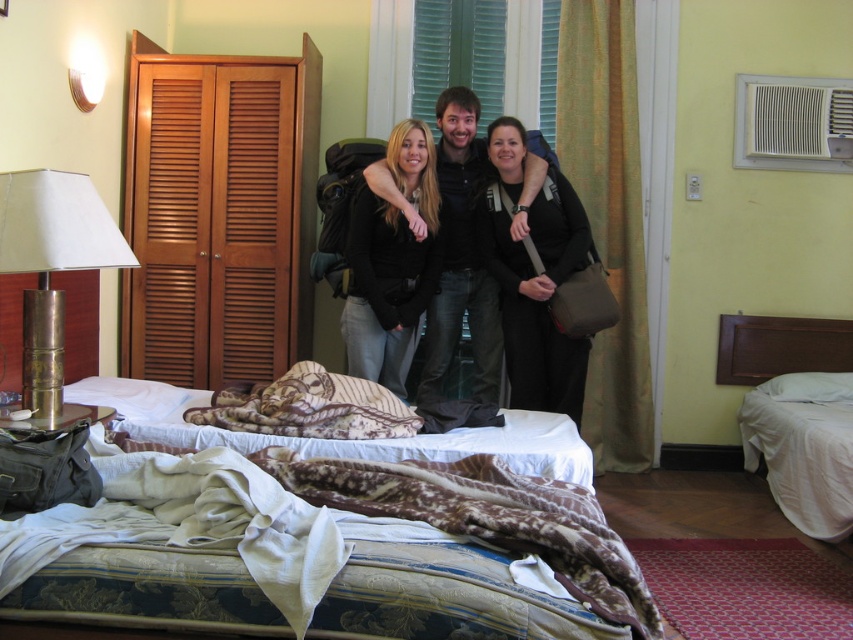
You are trying to decide whether to hang the black matte jacket at center on a coat hanger that is 1.2 meters tall. The brown textured blanket at center is nearby. Based on their heights, can the jacket be hung without touching the blanket?

The black matte jacket at center is much taller than the brown textured blanket at center. Since the jacket is taller, hanging it on a 1.2 meter hanger would require ensuring it doesn